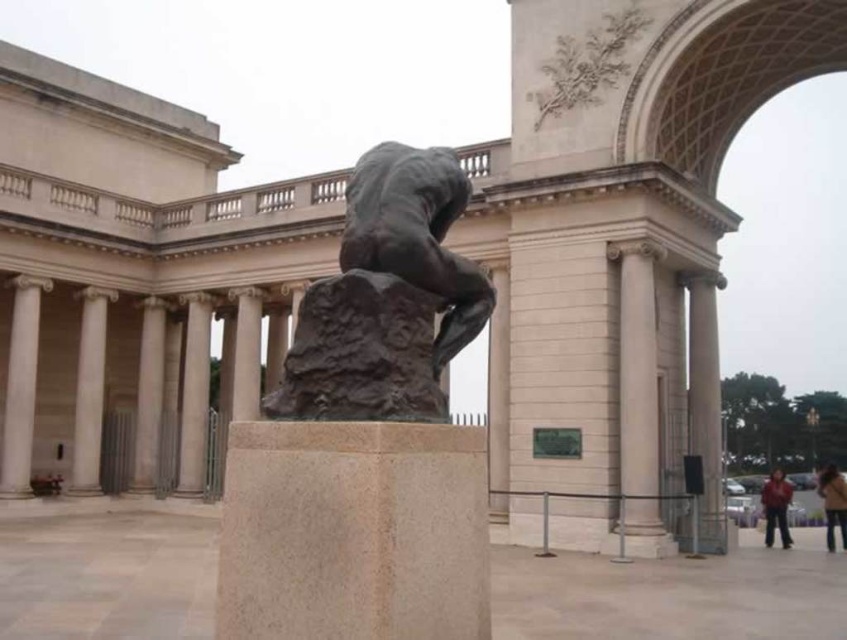
Question: Which of these objects is positioned farthest from the red leather jacket at lower right?

Choices:
 (A) smooth gray stone pillar at left
 (B) brown leather jacket at lower right

Answer: (A)

Question: Which is nearer to the smooth gray stone pillar at left?

Choices:
 (A) white marble column at left
 (B) red leather jacket at lower right
 (C) white marble column at center

Answer: (A)

Question: Among these points, which one is farthest from the camera?

Choices:
 (A) (375, 241)
 (B) (81, 362)
 (C) (202, 323)

Answer: (C)

Question: Observing the image, what is the correct spatial positioning of bronze statue at center in reference to white marble pillar at left?

Choices:
 (A) below
 (B) above

Answer: (B)

Question: Can you confirm if white marble column at center is positioned to the left of red leather jacket at lower right?

Choices:
 (A) no
 (B) yes

Answer: (B)

Question: Is smooth stone pillar at center right above red leather jacket at lower right?

Choices:
 (A) yes
 (B) no

Answer: (A)